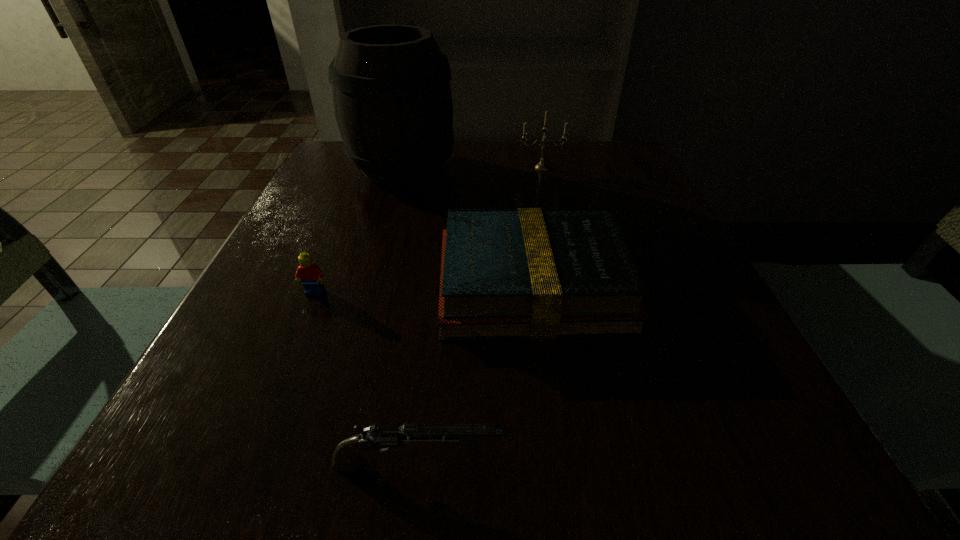
What are the coordinates of `wine bucket present at the far edge` in the screenshot? It's located at (392, 99).

Image resolution: width=960 pixels, height=540 pixels. I want to click on candle present at the far edge, so click(x=541, y=166).

The image size is (960, 540). Find the location of `object located at the near edge`. object located at the near edge is located at coordinates tap(380, 437).

Image resolution: width=960 pixels, height=540 pixels. What are the coordinates of `wine bucket present at the left edge` in the screenshot? It's located at (392, 99).

At what (x,y) coordinates should I click in order to perform the action: click on Lego present at the left edge. Please return your answer as a coordinate pair (x, y). This screenshot has width=960, height=540. Looking at the image, I should click on (310, 274).

Identify the location of object that is at the right edge. This screenshot has width=960, height=540. (529, 273).

The width and height of the screenshot is (960, 540). I want to click on object present at the far left corner, so click(392, 99).

Where is `vacant space at the far edge of the desktop`? vacant space at the far edge of the desktop is located at coordinates (514, 153).

Image resolution: width=960 pixels, height=540 pixels. What are the coordinates of `free space at the near edge` in the screenshot? It's located at (567, 477).

Find the location of a particular element. vacant space at the left edge is located at coordinates (317, 204).